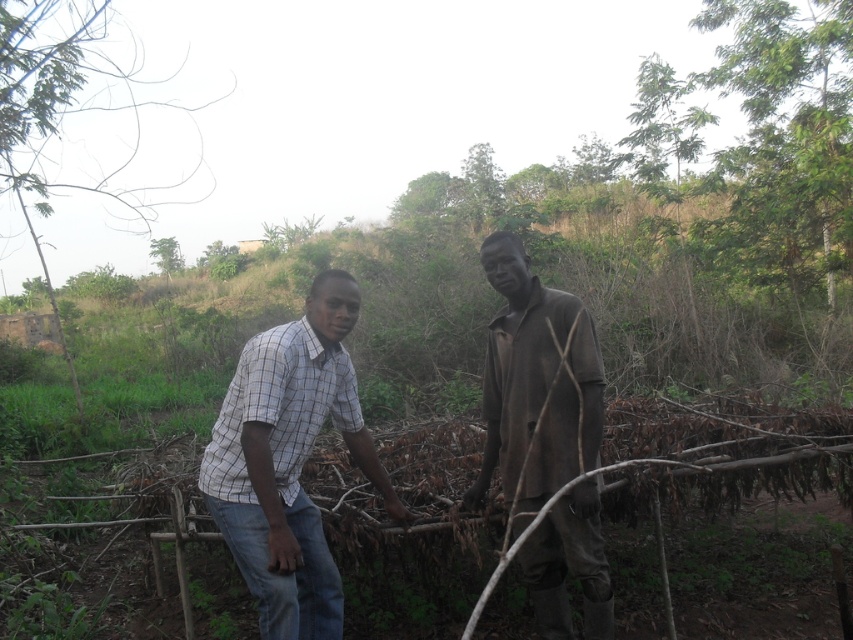
Between checkered fabric shirt at center and green leafy tree at left, which one is positioned higher?

green leafy tree at left

Is point (323, 564) positioned in front of point (78, 408)?

Yes, point (323, 564) is closer to viewer.

The width and height of the screenshot is (853, 640). What are the coordinates of `checkered fabric shirt at center` in the screenshot? It's located at (x=289, y=461).

Is checkered fabric shirt at center to the right of green leafy tree at upper center from the viewer's perspective?

Correct, you'll find checkered fabric shirt at center to the right of green leafy tree at upper center.

Is checkered fabric shirt at center further to the viewer compared to green leafy tree at upper center?

That is False.

From the picture: Who is more forward, (x=212, y=477) or (x=177, y=266)?

Point (x=212, y=477) is more forward.

Identify the location of checkered fabric shirt at center. pos(289,461).

Who is positioned more to the left, green leafy tree at left or green leafy tree at upper center?

Positioned to the left is green leafy tree at upper center.

Does point (21, 129) come behind point (165, 241)?

No.

Identify the location of green leafy tree at left. This screenshot has height=640, width=853. (70, 113).